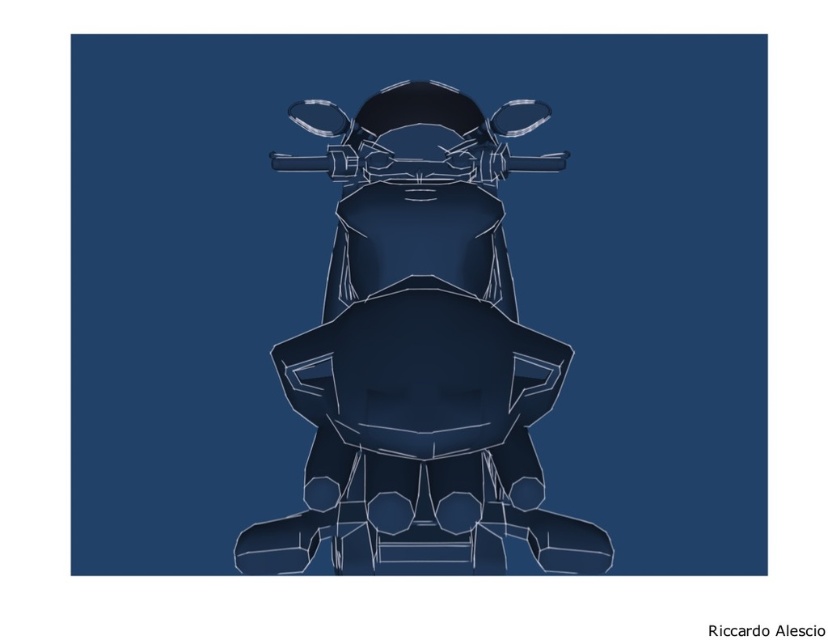
You are standing in front of a motorcycle displayed against a dark blue background. There is a point at coordinates (x=421, y=356). What object is located at this point?

The point at coordinates (x=421, y=356) is where the matte dark blue motorcycle at center is located.

You are a photographer setting up a shot of the matte dark blue motorcycle at center. Your camera requires the subject to be exactly 18 inches away for optimal focus. Based on the scene description, is the motorcycle positioned at the correct distance for your camera?

The matte dark blue motorcycle at center is 17.56 inches away from the camera, which is slightly closer than the required 18 inches. To achieve optimal focus, the motorcycle should be moved back approximately 0.44 inches.

Looking at this image, you are a designer working on a new motorcycle model. You have the matte dark blue motorcycle at center and a transparent plastic gun at center in front of you. Which object should you choose if you need to create a larger prototype for a presentation?

The matte dark blue motorcycle at center is bigger than the transparent plastic gun at center, so you should choose the matte dark blue motorcycle at center for the larger prototype.